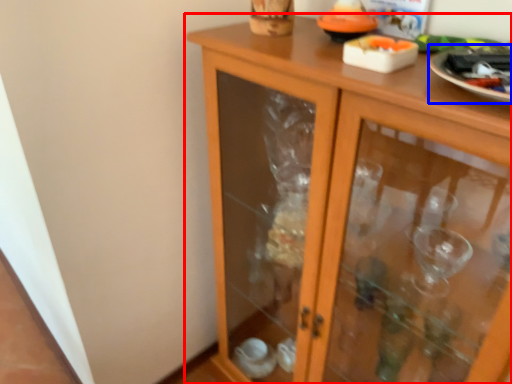
Question: Which object appears closest to the camera in this image, cupboard (highlighted by a red box) or glass plate (highlighted by a blue box)?

Choices:
 (A) cupboard
 (B) glass plate

Answer: (A)